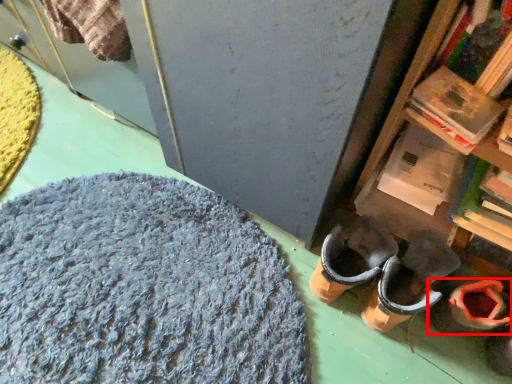
Question: Considering the relative positions of footwear (annotated by the red box) and wool in the image provided, where is footwear (annotated by the red box) located with respect to the staircase?

Choices:
 (A) left
 (B) right

Answer: (B)